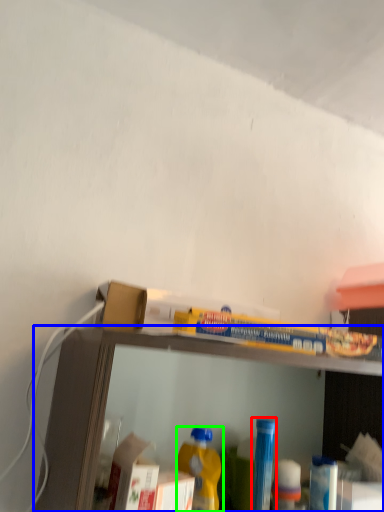
Question: Which is farther away from bottle (highlighted by a red box)? shelf (highlighted by a blue box) or bottle (highlighted by a green box)?

Choices:
 (A) shelf
 (B) bottle

Answer: (A)